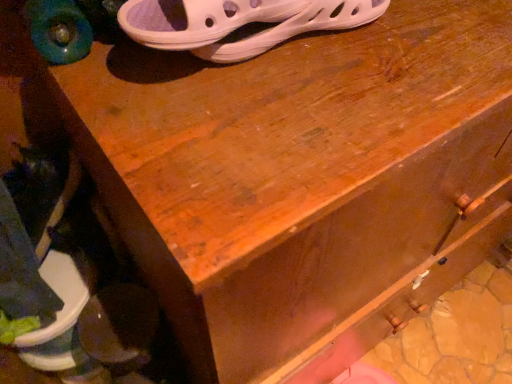
Describe the element at coordinates (63, 323) in the screenshot. I see `dark brown leather shoe at lower left, the 2th footwear in the front-to-back sequence` at that location.

You are a GUI agent. You are given a task and a screenshot of the screen. Output one action in this format:
    pyautogui.click(x=<x>, y=<y>)
    Task: Click on the dark brown leather shoe at lower left, acting as the 2th footwear starting from the top
    
    Given the screenshot: What is the action you would take?
    pyautogui.click(x=63, y=323)

What do you see at coordinates (237, 23) in the screenshot? The image size is (512, 384). I see `white mesh sandal at upper center, which appears as the 2th footwear when viewed from the left` at bounding box center [237, 23].

What is the approximate width of white mesh sandal at upper center, the first footwear in the front-to-back sequence?

4.16 inches.

At what (x,y) coordinates should I click in order to perform the action: click on white mesh sandal at upper center, which appears as the 2th footwear when viewed from the left. Please return your answer as a coordinate pair (x, y). The width and height of the screenshot is (512, 384). Looking at the image, I should click on (237, 23).

This screenshot has height=384, width=512. I want to click on dark brown leather shoe at lower left, the 2th footwear in the front-to-back sequence, so click(63, 323).

Looking at this image, can you confirm if white mesh sandal at upper center, which appears as the 2th footwear when viewed from the left, is positioned to the left of dark brown leather shoe at lower left, which is the first footwear in bottom-to-top order?

In fact, white mesh sandal at upper center, which appears as the 2th footwear when viewed from the left, is to the right of dark brown leather shoe at lower left, which is the first footwear in bottom-to-top order.

Considering the relative positions of white mesh sandal at upper center, which is the 1th footwear from right to left, and dark brown leather shoe at lower left, which is the first footwear in bottom-to-top order, in the image provided, is white mesh sandal at upper center, which is the 1th footwear from right to left, behind dark brown leather shoe at lower left, which is the first footwear in bottom-to-top order,?

No, white mesh sandal at upper center, which is the 1th footwear from right to left, is in front of dark brown leather shoe at lower left, which is the first footwear in bottom-to-top order.

Considering the positions of point (242, 50) and point (25, 362), is point (242, 50) closer or farther from the camera than point (25, 362)?

Point (242, 50).

From the image's perspective, is white mesh sandal at upper center, which appears as the 2th footwear when viewed from the left, on top of dark brown leather shoe at lower left, placed as the 2th footwear when sorted from right to left?

Yes, from the image's perspective, white mesh sandal at upper center, which appears as the 2th footwear when viewed from the left, is above dark brown leather shoe at lower left, placed as the 2th footwear when sorted from right to left.

From a real-world perspective, is white mesh sandal at upper center, which is counted as the 2th footwear, starting from the back, under dark brown leather shoe at lower left, which is the first footwear in bottom-to-top order?

No, from a real-world perspective, white mesh sandal at upper center, which is counted as the 2th footwear, starting from the back, is not under dark brown leather shoe at lower left, which is the first footwear in bottom-to-top order.

Which object is wider, white mesh sandal at upper center, which appears as the 2th footwear when viewed from the left, or dark brown leather shoe at lower left, positioned as the first footwear in left-to-right order?

dark brown leather shoe at lower left, positioned as the first footwear in left-to-right order.

Who is taller, white mesh sandal at upper center, which is the 1th footwear from right to left, or dark brown leather shoe at lower left, which is the first footwear in bottom-to-top order?

dark brown leather shoe at lower left, which is the first footwear in bottom-to-top order.

Can you confirm if white mesh sandal at upper center, arranged as the 2th footwear when ordered from the bottom, is smaller than dark brown leather shoe at lower left, which is the first footwear in bottom-to-top order?

Indeed, white mesh sandal at upper center, arranged as the 2th footwear when ordered from the bottom, has a smaller size compared to dark brown leather shoe at lower left, which is the first footwear in bottom-to-top order.

Is dark brown leather shoe at lower left, placed as the 2th footwear when sorted from right to left, surrounded by white mesh sandal at upper center, arranged as the 2th footwear when ordered from the bottom?

No, dark brown leather shoe at lower left, placed as the 2th footwear when sorted from right to left, is not inside white mesh sandal at upper center, arranged as the 2th footwear when ordered from the bottom.

Is white mesh sandal at upper center, which is the 1th footwear from right to left, not close to dark brown leather shoe at lower left, placed as the 2th footwear when sorted from right to left?

No.

Is white mesh sandal at upper center, which is the 1th footwear from top to bottom, turned away from dark brown leather shoe at lower left, the 2th footwear in the front-to-back sequence?

No, dark brown leather shoe at lower left, the 2th footwear in the front-to-back sequence, is not at the back of white mesh sandal at upper center, which is the 1th footwear from top to bottom.

How many degrees apart are the facing directions of white mesh sandal at upper center, which appears as the 2th footwear when viewed from the left, and dark brown leather shoe at lower left, the 2th footwear in the front-to-back sequence?

white mesh sandal at upper center, which appears as the 2th footwear when viewed from the left, and dark brown leather shoe at lower left, the 2th footwear in the front-to-back sequence, are facing 0.949 degrees away from each other.

The height and width of the screenshot is (384, 512). I want to click on footwear below the white mesh sandal at upper center, which is the 1th footwear from top to bottom (from a real-world perspective), so [x=63, y=323].

Can you confirm if dark brown leather shoe at lower left, which is the first footwear in bottom-to-top order, is positioned to the left of white mesh sandal at upper center, which is the 1th footwear from top to bottom?

Yes, dark brown leather shoe at lower left, which is the first footwear in bottom-to-top order, is to the left of white mesh sandal at upper center, which is the 1th footwear from top to bottom.

Considering the positions of objects dark brown leather shoe at lower left, acting as the 2th footwear starting from the top, and white mesh sandal at upper center, which is the 1th footwear from right to left, in the image provided, who is in front, dark brown leather shoe at lower left, acting as the 2th footwear starting from the top, or white mesh sandal at upper center, which is the 1th footwear from right to left,?

white mesh sandal at upper center, which is the 1th footwear from right to left, is more forward.

Considering the positions of points (63, 349) and (250, 10), is point (63, 349) closer to camera compared to point (250, 10)?

No, (63, 349) is further to viewer.

From the image's perspective, is dark brown leather shoe at lower left, acting as the 2th footwear starting from the top, located above or below white mesh sandal at upper center, arranged as the 2th footwear when ordered from the bottom?

Based on their image positions, dark brown leather shoe at lower left, acting as the 2th footwear starting from the top, is located beneath white mesh sandal at upper center, arranged as the 2th footwear when ordered from the bottom.

From a real-world perspective, is dark brown leather shoe at lower left, placed as the 2th footwear when sorted from right to left, positioned over white mesh sandal at upper center, arranged as the 2th footwear when ordered from the bottom, based on gravity?

No, from a real-world perspective, dark brown leather shoe at lower left, placed as the 2th footwear when sorted from right to left, is not on top of white mesh sandal at upper center, arranged as the 2th footwear when ordered from the bottom.

Considering the sizes of objects dark brown leather shoe at lower left, the 2th footwear in the front-to-back sequence, and white mesh sandal at upper center, the first footwear in the front-to-back sequence, in the image provided, who is wider, dark brown leather shoe at lower left, the 2th footwear in the front-to-back sequence, or white mesh sandal at upper center, the first footwear in the front-to-back sequence,?

dark brown leather shoe at lower left, the 2th footwear in the front-to-back sequence.

In terms of height, does dark brown leather shoe at lower left, the 1th footwear positioned from the back, look taller or shorter compared to white mesh sandal at upper center, which is the 1th footwear from top to bottom?

dark brown leather shoe at lower left, the 1th footwear positioned from the back, is taller than white mesh sandal at upper center, which is the 1th footwear from top to bottom.

Is dark brown leather shoe at lower left, which is the first footwear in bottom-to-top order, bigger or smaller than white mesh sandal at upper center, arranged as the 2th footwear when ordered from the bottom?

Clearly, dark brown leather shoe at lower left, which is the first footwear in bottom-to-top order, is larger in size than white mesh sandal at upper center, arranged as the 2th footwear when ordered from the bottom.

Is dark brown leather shoe at lower left, placed as the 2th footwear when sorted from right to left, inside or outside of white mesh sandal at upper center, the first footwear in the front-to-back sequence?

dark brown leather shoe at lower left, placed as the 2th footwear when sorted from right to left, lies outside white mesh sandal at upper center, the first footwear in the front-to-back sequence.

Is dark brown leather shoe at lower left, acting as the 2th footwear starting from the top, not near white mesh sandal at upper center, which is counted as the 2th footwear, starting from the back?

They are positioned close to each other.

Is dark brown leather shoe at lower left, placed as the 2th footwear when sorted from right to left, looking in the opposite direction of white mesh sandal at upper center, arranged as the 2th footwear when ordered from the bottom?

dark brown leather shoe at lower left, placed as the 2th footwear when sorted from right to left, is not turned away from white mesh sandal at upper center, arranged as the 2th footwear when ordered from the bottom.

Locate an element on the screen. The width and height of the screenshot is (512, 384). footwear below the white mesh sandal at upper center, arranged as the 2th footwear when ordered from the bottom (from a real-world perspective) is located at coordinates (63, 323).

The height and width of the screenshot is (384, 512). I want to click on footwear in front of the dark brown leather shoe at lower left, acting as the 2th footwear starting from the top, so click(x=237, y=23).

I want to click on footwear on the left of the white mesh sandal at upper center, which is counted as the 2th footwear, starting from the back, so click(63, 323).